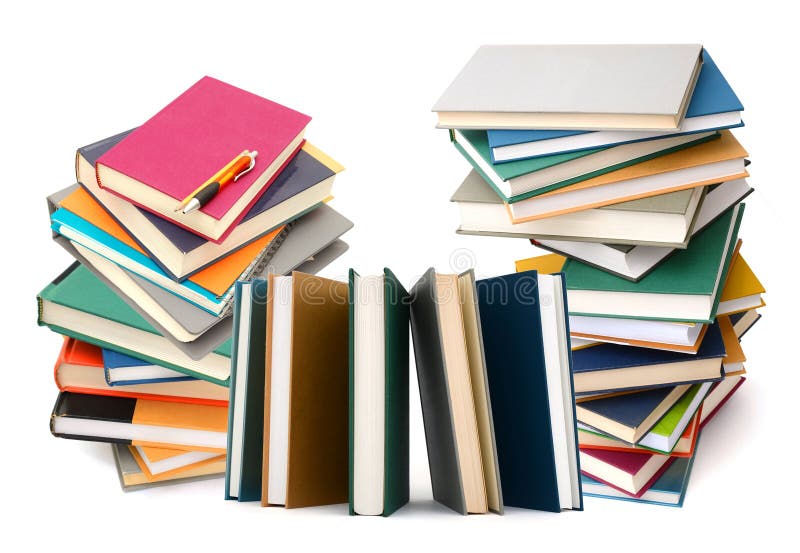
Locate an element on the screen. This screenshot has width=800, height=553. vertical books is located at coordinates (244, 383), (297, 403), (366, 404), (450, 393), (513, 383).